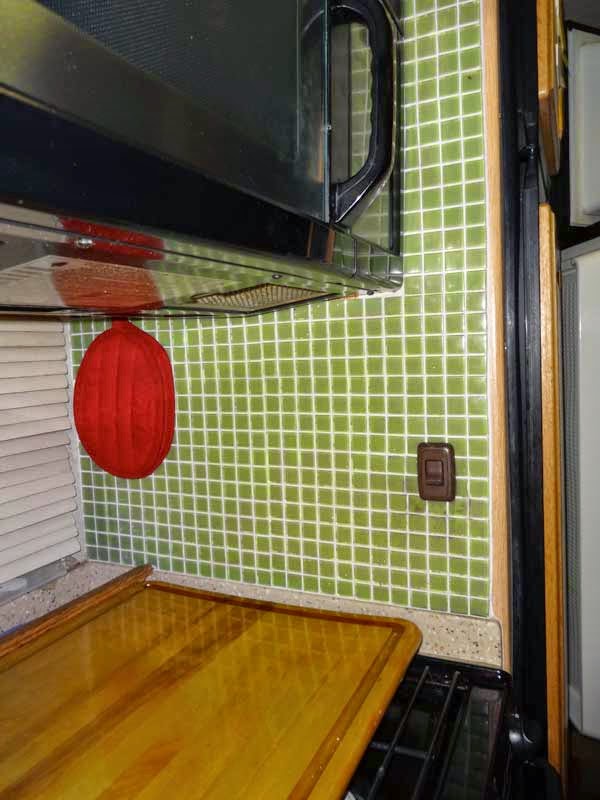
Locate an element on the screen. pot holder is located at coordinates (111, 381).